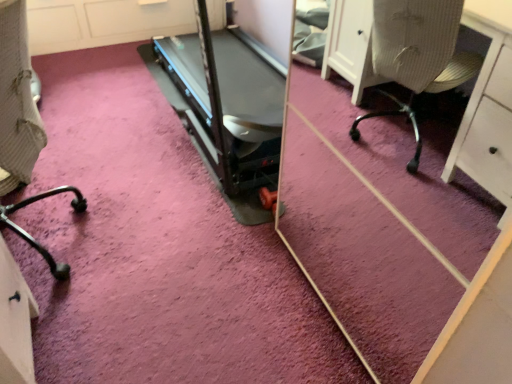
Question: From a real-world perspective, is black metal chair leg at lower left physically located above or below black plastic treadmill at center?

Choices:
 (A) below
 (B) above

Answer: (B)

Question: From the image's perspective, is black metal chair leg at lower left above or below black plastic treadmill at center?

Choices:
 (A) below
 (B) above

Answer: (A)

Question: Is black metal chair leg at lower left bigger or smaller than black plastic treadmill at center?

Choices:
 (A) small
 (B) big

Answer: (A)

Question: Does point (234, 148) appear closer or farther from the camera than point (15, 228)?

Choices:
 (A) closer
 (B) farther

Answer: (B)

Question: Based on their sizes in the image, would you say black plastic treadmill at center is bigger or smaller than black metal chair leg at lower left?

Choices:
 (A) big
 (B) small

Answer: (A)

Question: From the image's perspective, is black plastic treadmill at center positioned above or below black metal chair leg at lower left?

Choices:
 (A) below
 (B) above

Answer: (B)

Question: Is black plastic treadmill at center taller or shorter than black metal chair leg at lower left?

Choices:
 (A) short
 (B) tall

Answer: (A)